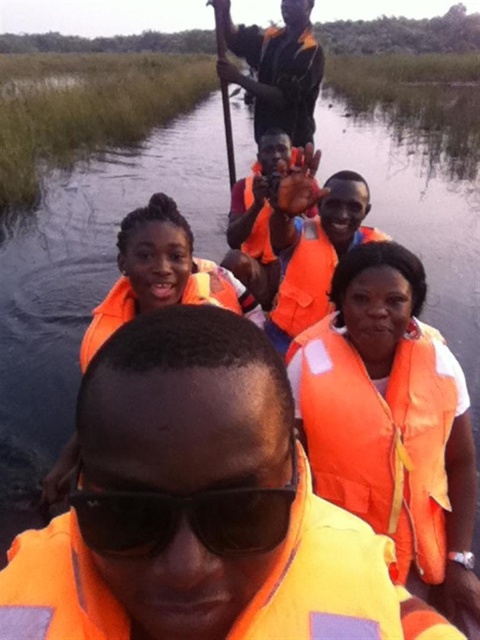
Is orange fabric life vest at center taller than orange life vest at upper center?

Correct, orange fabric life vest at center is much taller as orange life vest at upper center.

Does orange fabric life vest at center lie in front of orange life vest at upper center?

Yes, orange fabric life vest at center is in front of orange life vest at upper center.

Identify the location of orange fabric life vest at center. This screenshot has height=640, width=480. (392, 420).

Between orange fabric life vest at center and black plastic goggles at center, which one has less height?

Standing shorter between the two is black plastic goggles at center.

Between point (471, 472) and point (183, 504), which one is positioned in front?

Positioned in front is point (183, 504).

Identify the location of orange fabric life vest at center. The image size is (480, 640). (392, 420).

Between orange/yellow fabric life jacket at center and orange matte life jacket at center, which one has less height?

orange/yellow fabric life jacket at center

Is point (9, 596) closer to viewer compared to point (256, 224)?

Yes, point (9, 596) is closer to viewer.

Where is `orange/yellow fabric life jacket at center`? This screenshot has height=640, width=480. orange/yellow fabric life jacket at center is located at coordinates (335, 582).

Locate an element on the screen. This screenshot has width=480, height=640. orange/yellow fabric life jacket at center is located at coordinates (335, 582).